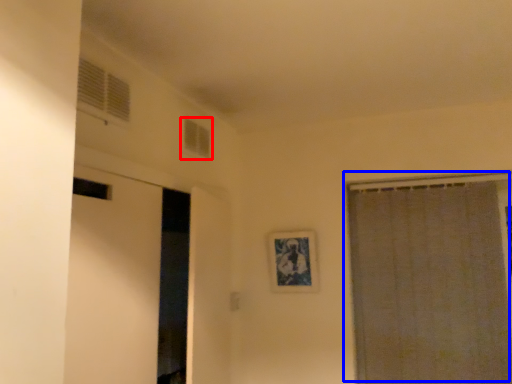
Question: Which object is further to the camera taking this photo, window (highlighted by a red box) or curtain (highlighted by a blue box)?

Choices:
 (A) window
 (B) curtain

Answer: (B)